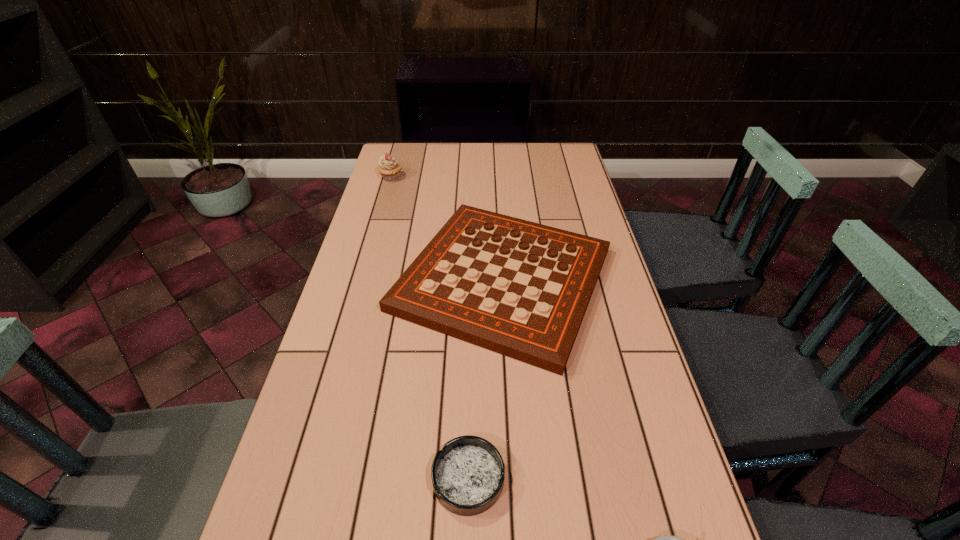
Locate an element on the screen. cupcake is located at coordinates (389, 168).

Where is `the tallest object`? The width and height of the screenshot is (960, 540). the tallest object is located at coordinates (389, 168).

Where is `the second tallest object`? The image size is (960, 540). the second tallest object is located at coordinates (521, 289).

Identify the location of the second farthest object. (521, 289).

Locate an element on the screen. This screenshot has height=540, width=960. the farther ashtray is located at coordinates (468, 473).

The height and width of the screenshot is (540, 960). In order to click on the left ashtray in this screenshot , I will do `click(468, 473)`.

Locate an element on the screen. This screenshot has width=960, height=540. vacant space situated 0.060m on the right of the leftmost object is located at coordinates (419, 177).

Locate an element on the screen. vacant region located on the back of the third shortest object is located at coordinates [x=496, y=169].

You are a GUI agent. You are given a task and a screenshot of the screen. Output one action in this format:
    pyautogui.click(x=<x>, y=<y>)
    Task: Click on the vacant region located on the back of the left ashtray
    This screenshot has height=540, width=960.
    Given the screenshot: What is the action you would take?
    pyautogui.click(x=470, y=364)

The height and width of the screenshot is (540, 960). I want to click on object that is positioned at the far edge, so click(x=389, y=168).